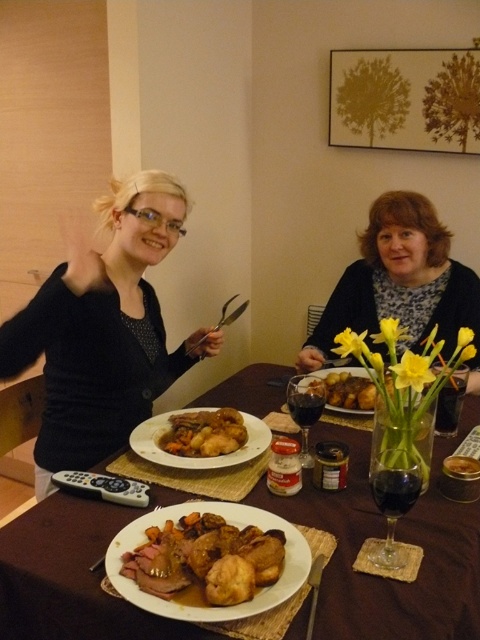
You are sitting at the brown wooden table at center and want to reach the brown crispy chicken at center. Is the chicken within your immediate reach from your current position?

The brown wooden table at center is in front of the brown crispy chicken at center, so the chicken is directly in front of you on the table. Since both are at the center, the chicken should be within your immediate reach.

You are a guest at a dinner party and want to reach for the golden brown crispy chicken at center. From your seat, which is located at the edge of the brown wooden table at center, in which direction should you reach to get the chicken?

The golden brown crispy chicken at center is above the brown wooden table at center, so you should reach upward to get the chicken.

You are taking a photo of the dining table and want to focus on both the point at point (x=215, y=600) and the point at point (x=236, y=435). Which point should you adjust your focus to first to ensure the closer one is sharp?

Point (x=215, y=600) is closer to the camera than point (x=236, y=435), so you should focus on point (x=215, y=600) first to ensure it is sharp.